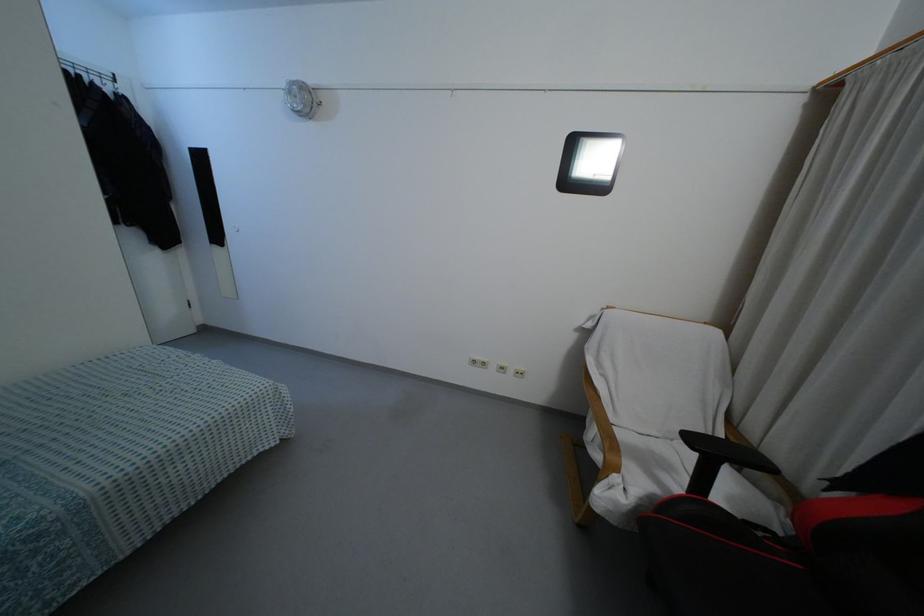
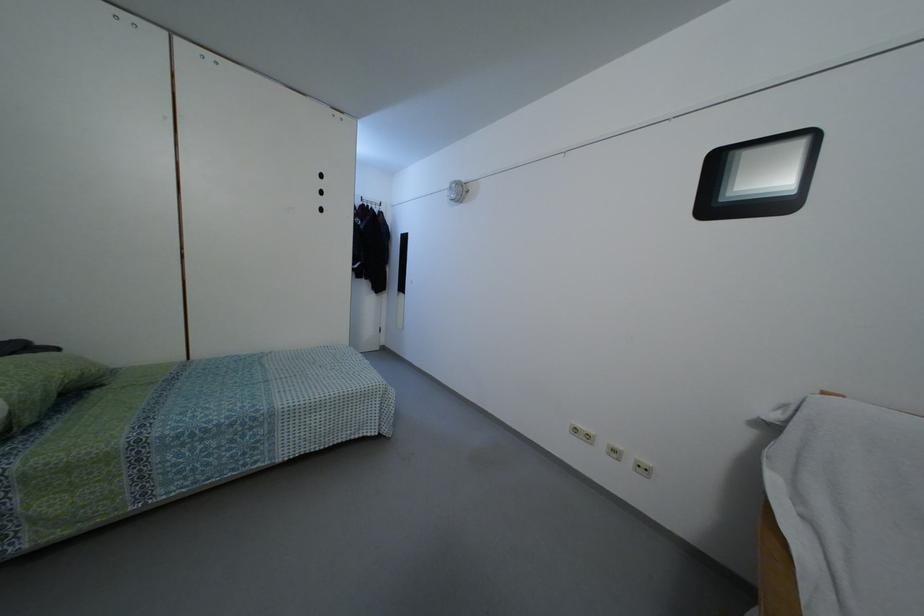
Find the pixel in the second image that matches [473,361] in the first image.

(575, 430)